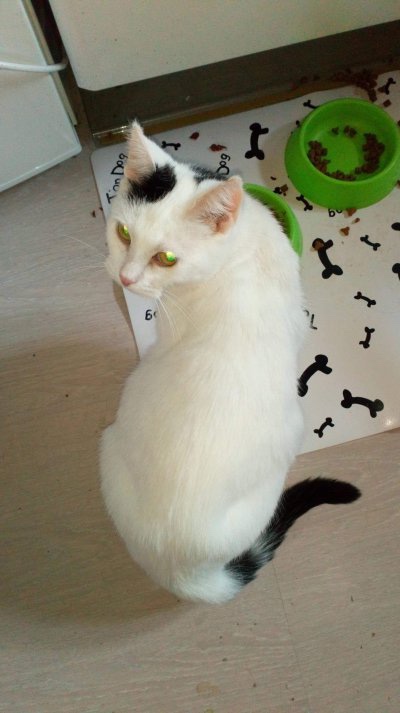
I want to click on floor, so click(351, 602).